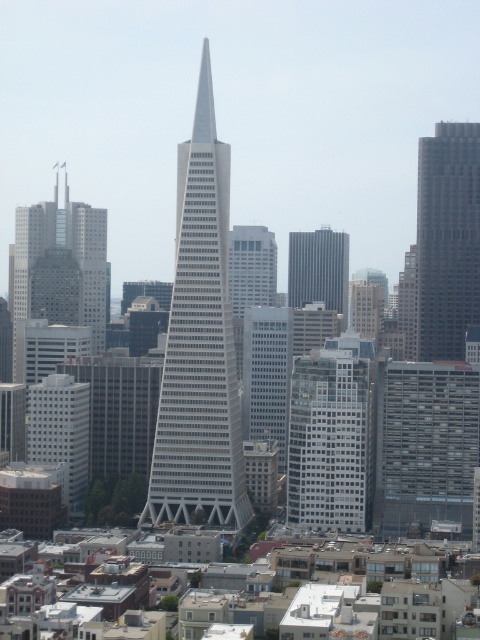
Question: Among these points, which one is nearest to the camera?

Choices:
 (A) (316, 264)
 (B) (337, 499)

Answer: (A)

Question: Is white glass skyscraper at center smaller than matte glass skyscraper at left?

Choices:
 (A) yes
 (B) no

Answer: (B)

Question: Can you confirm if white glass skyscraper at center is thinner than gray concrete building at right?

Choices:
 (A) yes
 (B) no

Answer: (B)

Question: Estimate the real-world distances between objects in this image. Which object is closer to the white glass building at center?

Choices:
 (A) gray glass skyscraper at center
 (B) white glass skyscraper at center
 (C) matte glass skyscraper at left
 (D) gray concrete building at right

Answer: (A)

Question: Is white glass skyscraper at center bigger than gray glass skyscraper at center?

Choices:
 (A) no
 (B) yes

Answer: (B)

Question: Which object is the farthest from the gray glass skyscraper at center?

Choices:
 (A) white glass building at center
 (B) white glass skyscraper at center
 (C) matte glass skyscraper at left

Answer: (C)